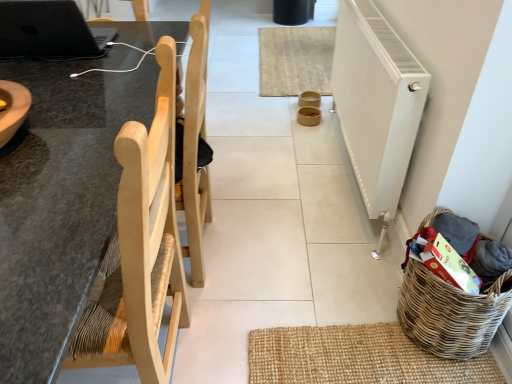
Question: From the image's perspective, is white textured radiator at right below natural fiber mat at center?

Choices:
 (A) no
 (B) yes

Answer: (B)

Question: Can you confirm if white textured radiator at right is shorter than natural fiber mat at center?

Choices:
 (A) no
 (B) yes

Answer: (A)

Question: Is white textured radiator at right oriented towards natural fiber mat at center?

Choices:
 (A) yes
 (B) no

Answer: (B)

Question: Would you say white textured radiator at right is a long distance from natural fiber mat at center?

Choices:
 (A) no
 (B) yes

Answer: (B)

Question: Is white textured radiator at right closer to the viewer compared to natural fiber mat at center?

Choices:
 (A) no
 (B) yes

Answer: (B)

Question: In terms of width, does white textured radiator at right look wider or thinner when compared to natural wood chair at left?

Choices:
 (A) thin
 (B) wide

Answer: (A)

Question: Based on their sizes in the image, would you say white textured radiator at right is bigger or smaller than natural wood chair at left?

Choices:
 (A) small
 (B) big

Answer: (A)

Question: Considering the relative positions of white textured radiator at right and natural wood chair at left in the image provided, is white textured radiator at right to the left or to the right of natural wood chair at left?

Choices:
 (A) right
 (B) left

Answer: (A)

Question: Is point (332, 92) positioned closer to the camera than point (119, 130)?

Choices:
 (A) closer
 (B) farther

Answer: (B)

Question: Is natural wood chair at left inside the boundaries of woven brown basket at lower right, or outside?

Choices:
 (A) inside
 (B) outside

Answer: (B)

Question: From the image's perspective, is natural wood chair at left located above or below woven brown basket at lower right?

Choices:
 (A) below
 (B) above

Answer: (B)

Question: Is natural wood chair at left in front of or behind woven brown basket at lower right in the image?

Choices:
 (A) behind
 (B) front

Answer: (B)

Question: In the image, is natural wood chair at left on the left side or the right side of woven brown basket at lower right?

Choices:
 (A) right
 (B) left

Answer: (B)

Question: From the image's perspective, is black matte laptop at upper left positioned above or below woven brown basket at lower right?

Choices:
 (A) above
 (B) below

Answer: (A)

Question: Considering the positions of black matte laptop at upper left and woven brown basket at lower right in the image, is black matte laptop at upper left taller or shorter than woven brown basket at lower right?

Choices:
 (A) short
 (B) tall

Answer: (A)